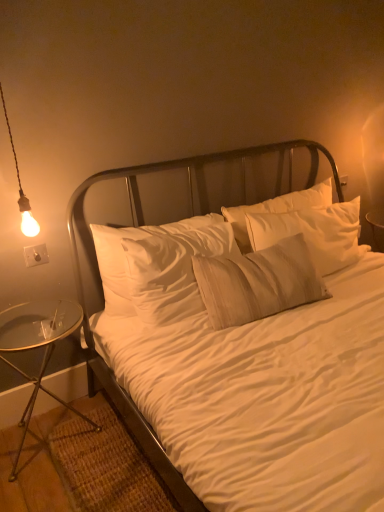
Question: From the image's perspective, would you say transparent glass table at lower left is positioned over matte bulb at left?

Choices:
 (A) no
 (B) yes

Answer: (A)

Question: From a real-world perspective, is transparent glass table at lower left under matte bulb at left?

Choices:
 (A) no
 (B) yes

Answer: (B)

Question: Is transparent glass table at lower left in front of matte bulb at left?

Choices:
 (A) yes
 (B) no

Answer: (B)

Question: Does transparent glass table at lower left appear on the right side of matte bulb at left?

Choices:
 (A) yes
 (B) no

Answer: (B)

Question: Is transparent glass table at lower left bigger than matte bulb at left?

Choices:
 (A) yes
 (B) no

Answer: (A)

Question: Could you tell me if transparent glass table at lower left is facing matte bulb at left?

Choices:
 (A) yes
 (B) no

Answer: (B)

Question: Is matte bulb at left oriented away from transparent glass table at lower left?

Choices:
 (A) no
 (B) yes

Answer: (A)

Question: From the image's perspective, is matte bulb at left on top of transparent glass table at lower left?

Choices:
 (A) yes
 (B) no

Answer: (A)

Question: Considering the relative sizes of matte bulb at left and transparent glass table at lower left in the image provided, is matte bulb at left shorter than transparent glass table at lower left?

Choices:
 (A) no
 (B) yes

Answer: (A)

Question: Is matte bulb at left oriented towards transparent glass table at lower left?

Choices:
 (A) yes
 (B) no

Answer: (B)

Question: Can we say matte bulb at left lies outside transparent glass table at lower left?

Choices:
 (A) yes
 (B) no

Answer: (A)

Question: Is matte bulb at left wider than transparent glass table at lower left?

Choices:
 (A) yes
 (B) no

Answer: (B)

Question: Is transparent glass table at lower left placed right next to white cotton bed at center?

Choices:
 (A) no
 (B) yes

Answer: (A)